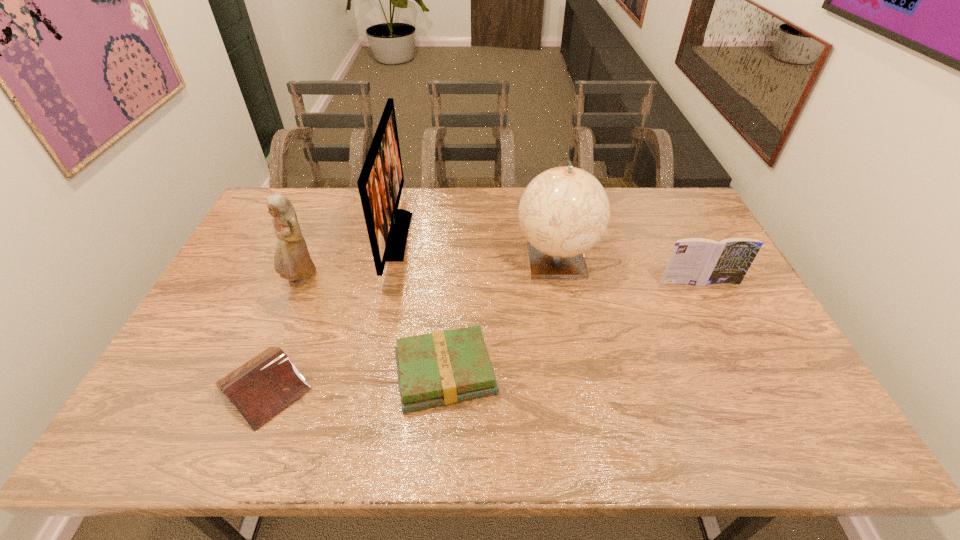
Locate an element on the screen. free location located on the front cover of the farthest book is located at coordinates (717, 320).

Find the location of a particular element. This screenshot has width=960, height=540. free space located on the left of the leftmost book is located at coordinates (185, 386).

This screenshot has height=540, width=960. I want to click on blank space located on the left of the second book from right to left, so click(x=336, y=374).

Identify the location of object present at the far edge. This screenshot has height=540, width=960. (380, 184).

Where is `object located at the left edge`? This screenshot has height=540, width=960. object located at the left edge is located at coordinates (265, 385).

The width and height of the screenshot is (960, 540). I want to click on object at the right edge, so click(x=694, y=261).

This screenshot has width=960, height=540. In order to click on object present at the near left corner in this screenshot , I will do `click(265, 385)`.

In the image, there is a desktop. In order to click on vacant space at the far edge in this screenshot , I will do `click(351, 205)`.

Identify the location of free location at the near edge. This screenshot has width=960, height=540. (680, 434).

Where is `free space at the left edge of the desktop`? The image size is (960, 540). free space at the left edge of the desktop is located at coordinates (224, 285).